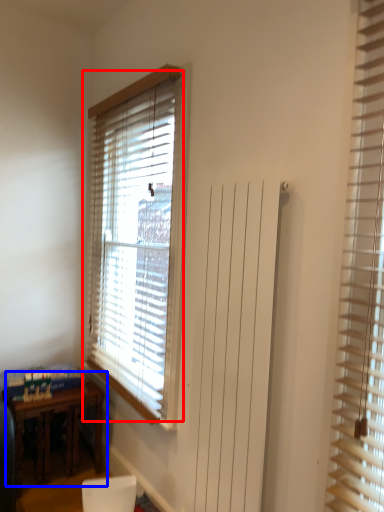
Question: Which point is closer to the camera, window blind (highlighted by a red box) or table (highlighted by a blue box)?

Choices:
 (A) window blind
 (B) table

Answer: (A)